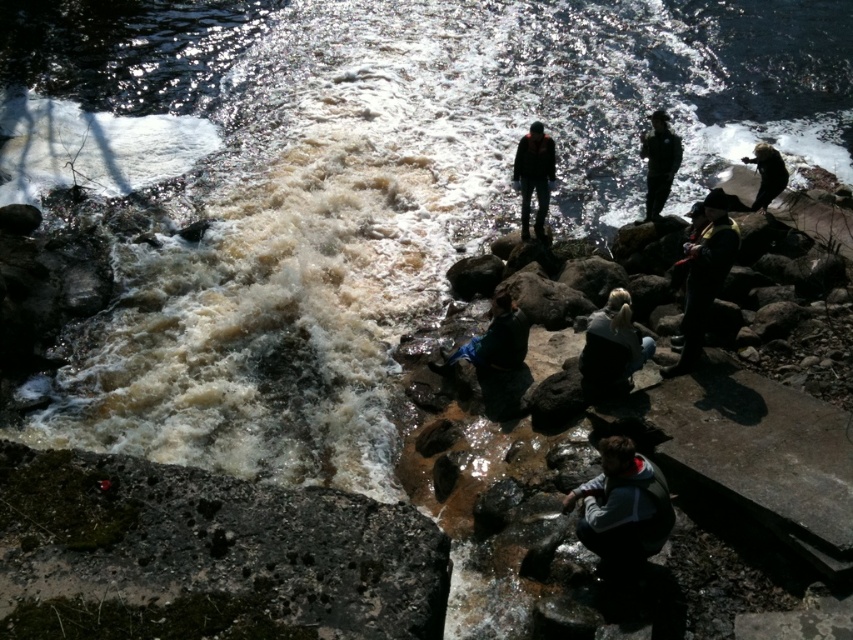
Question: Which object is closer to the camera taking this photo?

Choices:
 (A) gray fleece jacket at lower center
 (B) light blue denim jacket at lower center
 (C) dark brown fur at upper right
 (D) dark brown leather jacket at lower right

Answer: (A)

Question: Which point is farther to the camera?

Choices:
 (A) (693, 294)
 (B) (167, 568)

Answer: (A)

Question: Which object is the farthest from the dark blue jeans at center?

Choices:
 (A) dark brown fur at upper right
 (B) light blue denim jacket at lower center
 (C) dark brown leather jacket at lower right
 (D) green mossy rock at lower left

Answer: (D)

Question: Can you confirm if light blue denim jacket at lower center is positioned to the right of dark blue jeans at center?

Choices:
 (A) no
 (B) yes

Answer: (B)

Question: Is dark brown leather jacket at lower right positioned at the back of dark blue jeans at center?

Choices:
 (A) no
 (B) yes

Answer: (A)

Question: Is green mossy rock at lower left bigger than dark blue jeans at center?

Choices:
 (A) yes
 (B) no

Answer: (A)